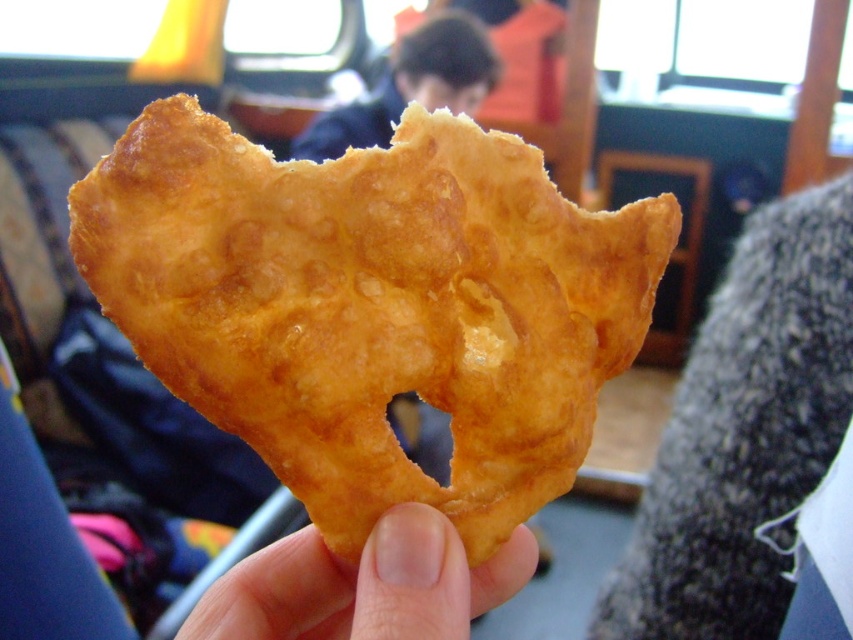
Question: Which of the following is the closest to the observer?

Choices:
 (A) (309, 614)
 (B) (474, 35)
 (C) (149, 246)

Answer: (C)

Question: Is golden crispy pastry at center wider than flesh-toned skin at center?

Choices:
 (A) no
 (B) yes

Answer: (B)

Question: Estimate the real-world distances between objects in this image. Which object is closer to the flesh-toned skin at center?

Choices:
 (A) golden crispy pastry at center
 (B) dark blue jacket at upper center

Answer: (A)

Question: Can you confirm if flesh-toned skin at center is positioned to the left of dark blue jacket at upper center?

Choices:
 (A) yes
 (B) no

Answer: (B)

Question: Does golden crispy pastry at center appear under dark blue jacket at upper center?

Choices:
 (A) no
 (B) yes

Answer: (B)

Question: Estimate the real-world distances between objects in this image. Which object is closer to the golden crispy pastry at center?

Choices:
 (A) dark blue jacket at upper center
 (B) flesh-toned skin at center

Answer: (B)